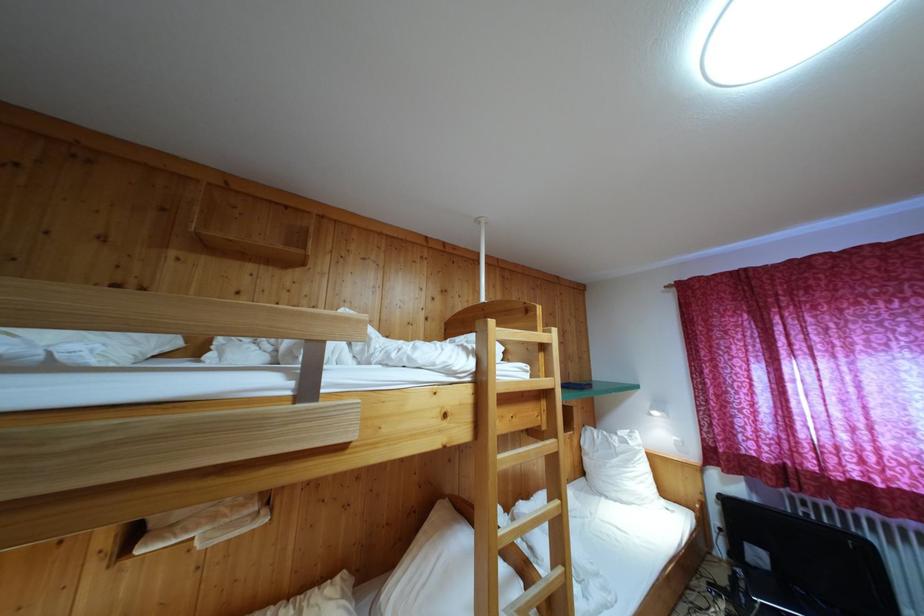
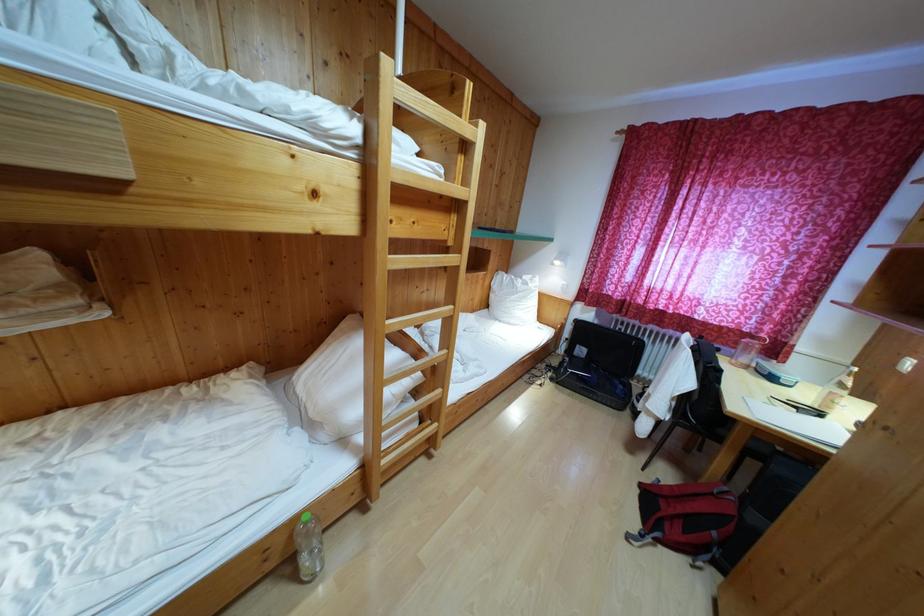
First-person continuous shooting, in which direction is the camera rotating?

The camera's rotation is toward right-down.